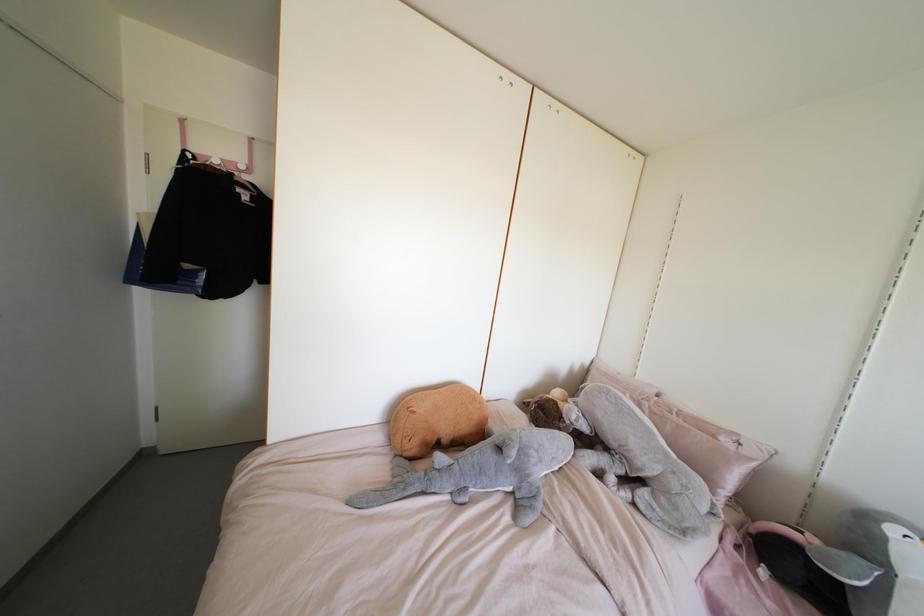
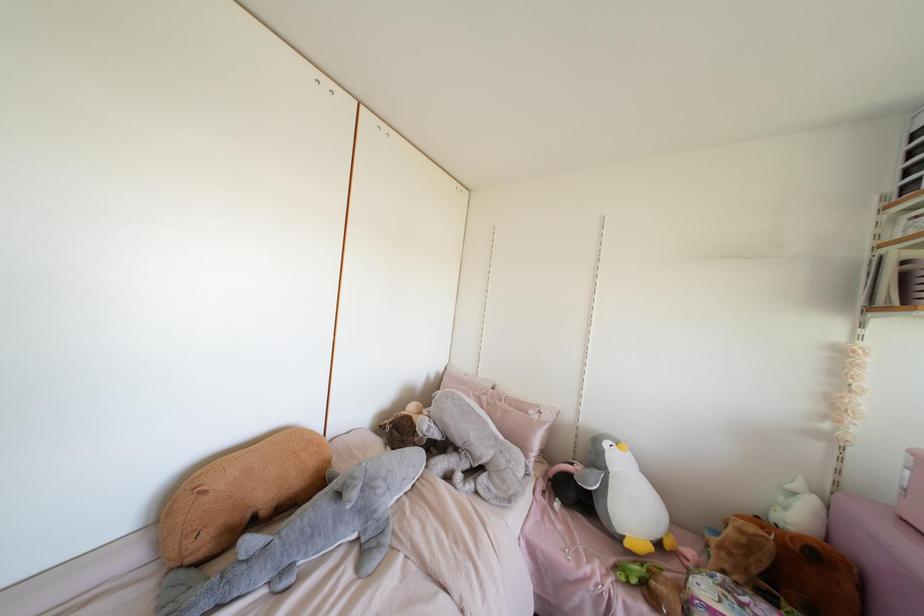
The point at (553, 458) is marked in the first image. Where is the corresponding point in the second image?

(403, 479)